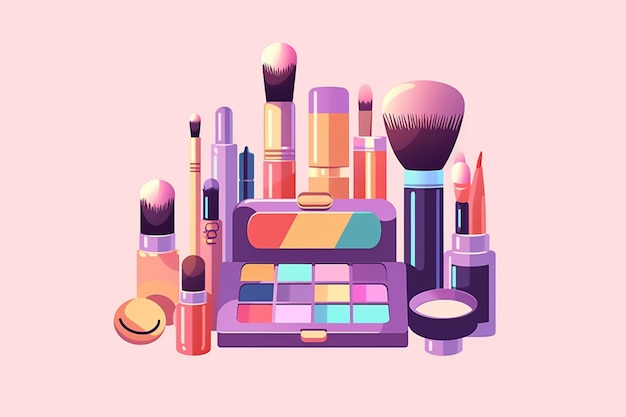
You are a GUI agent. You are given a task and a screenshot of the screen. Output one action in this format:
    pyautogui.click(x=<x>, y=<y>)
    Task: Click on the cup
    The image size is (626, 417).
    Given the screenshot: What is the action you would take?
    pyautogui.click(x=475, y=265)